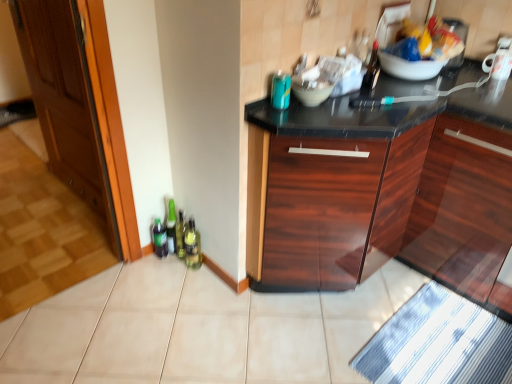
The height and width of the screenshot is (384, 512). In order to click on free space to the left of white glossy mug at upper right in this screenshot , I will do `click(466, 76)`.